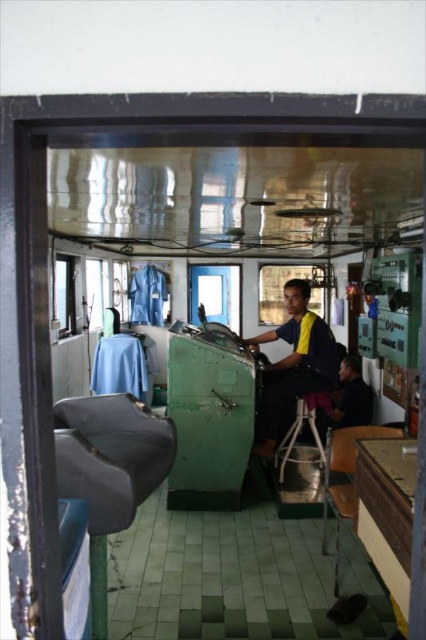
Which is more to the right, dark blue uniform at center or metallic silver stool at center?

metallic silver stool at center

At what (x,y) coordinates should I click in order to perform the action: click on dark blue uniform at center. Please return your answer as a coordinate pair (x, y). This screenshot has height=640, width=426. Looking at the image, I should click on (293, 364).

Is point (255, 340) positioned in front of point (275, 467)?

No.

You are a GUI agent. You are given a task and a screenshot of the screen. Output one action in this format:
    pyautogui.click(x=<x>, y=<y>)
    Task: Click on the dark blue uniform at center
    The height and width of the screenshot is (640, 426).
    Given the screenshot: What is the action you would take?
    pyautogui.click(x=293, y=364)

This screenshot has width=426, height=640. What do you see at coordinates (109, 470) in the screenshot? I see `matte gray plastic chair at left` at bounding box center [109, 470].

At what (x,y) coordinates should I click in order to perform the action: click on matte gray plastic chair at left. Please return your answer as a coordinate pair (x, y). Image resolution: width=426 pixels, height=640 pixels. Looking at the image, I should click on (109, 470).

Does matte gray plastic chair at left have a lesser width compared to metallic silver stool at center?

In fact, matte gray plastic chair at left might be wider than metallic silver stool at center.

Does matte gray plastic chair at left appear on the left side of metallic silver stool at center?

Correct, you'll find matte gray plastic chair at left to the left of metallic silver stool at center.

Which is in front, point (109, 492) or point (322, 400)?

Point (109, 492) is more forward.

At what (x,y) coordinates should I click in order to perform the action: click on matte gray plastic chair at left. Please return your answer as a coordinate pair (x, y). The height and width of the screenshot is (640, 426). Looking at the image, I should click on (109, 470).